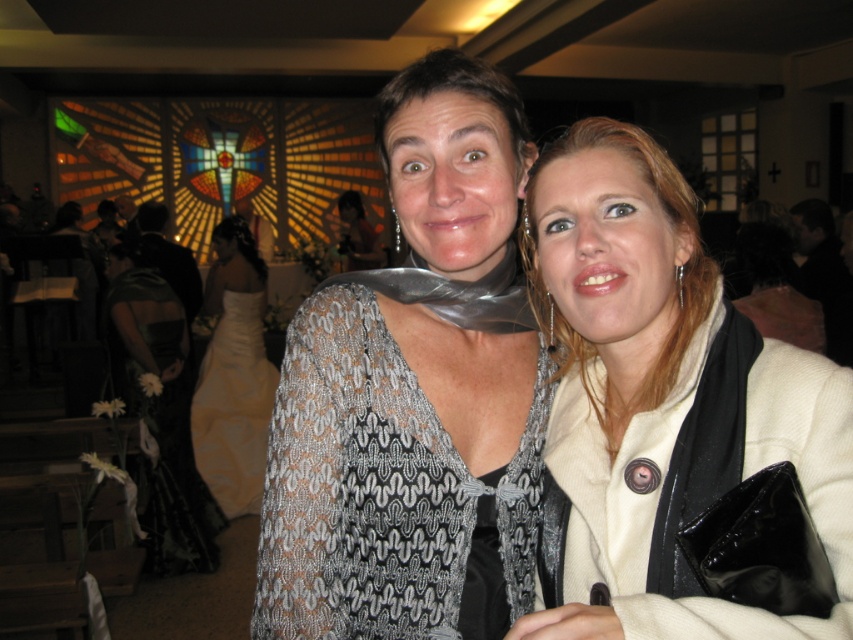
Question: Based on their relative distances, which object is farther from the patterned fabric dress at center?

Choices:
 (A) matte silver scarf at center
 (B) silver metallic dress at center
 (C) white matte coat at center

Answer: (A)

Question: Which object is positioned farthest from the matte silver scarf at center?

Choices:
 (A) white matte coat at center
 (B) patterned fabric dress at center
 (C) black satin dress at left

Answer: (A)

Question: Is white matte coat at center closer to camera compared to patterned fabric dress at center?

Choices:
 (A) no
 (B) yes

Answer: (B)

Question: Is the position of patterned fabric dress at center less distant than that of matte silver scarf at center?

Choices:
 (A) yes
 (B) no

Answer: (A)

Question: Which point is farther from the camera taking this photo?

Choices:
 (A) pyautogui.click(x=340, y=241)
 (B) pyautogui.click(x=206, y=458)
 (C) pyautogui.click(x=611, y=588)
 (D) pyautogui.click(x=393, y=408)

Answer: (A)

Question: Does patterned fabric dress at center have a smaller size compared to black satin dress at left?

Choices:
 (A) yes
 (B) no

Answer: (A)